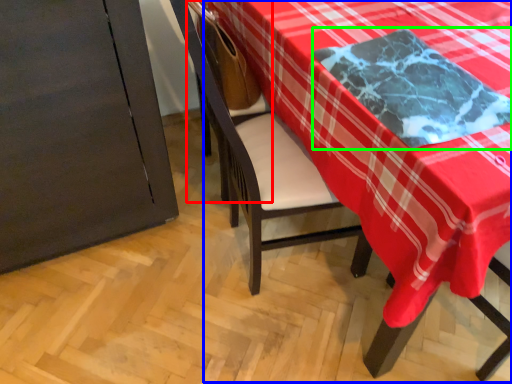
Question: Which object is positioned closest to armchair (highlighted by a red box)? Select from table (highlighted by a blue box) and cloth (highlighted by a green box).

Choices:
 (A) table
 (B) cloth

Answer: (A)